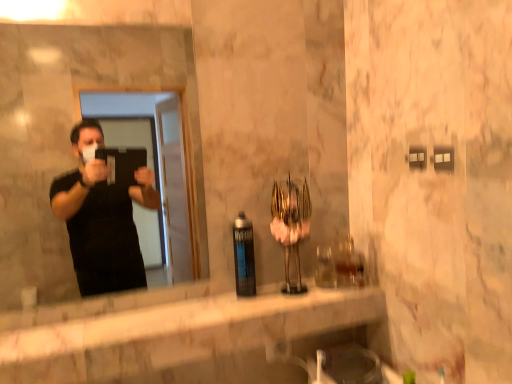
The width and height of the screenshot is (512, 384). What are the coordinates of `free space in front of matte black spray can at center` in the screenshot? It's located at (238, 314).